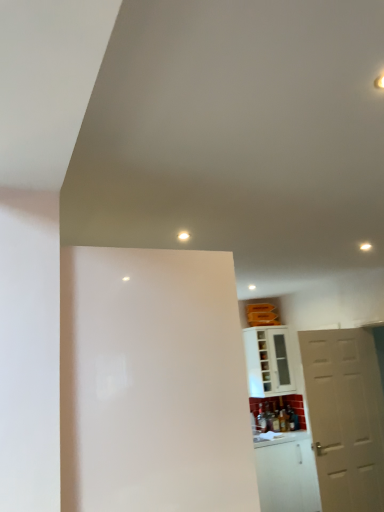
Question: Can you confirm if white matte door at right is wider than white glossy screen door at center?

Choices:
 (A) no
 (B) yes

Answer: (A)

Question: Can you confirm if white matte door at right is positioned to the right of white glossy screen door at center?

Choices:
 (A) yes
 (B) no

Answer: (A)

Question: Could you tell me if white matte door at right is facing white glossy screen door at center?

Choices:
 (A) yes
 (B) no

Answer: (B)

Question: Is white matte door at right in front of white glossy screen door at center?

Choices:
 (A) no
 (B) yes

Answer: (A)

Question: Considering the relative sizes of white matte door at right and white glossy screen door at center in the image provided, is white matte door at right smaller than white glossy screen door at center?

Choices:
 (A) no
 (B) yes

Answer: (B)

Question: Is white glossy cabinet at lower right inside or outside of white matte door at right?

Choices:
 (A) inside
 (B) outside

Answer: (B)

Question: Considering the positions of white glossy cabinet at lower right and white matte door at right in the image, is white glossy cabinet at lower right wider or thinner than white matte door at right?

Choices:
 (A) wide
 (B) thin

Answer: (A)

Question: From the image's perspective, is white glossy cabinet at lower right positioned above or below white matte door at right?

Choices:
 (A) above
 (B) below

Answer: (A)

Question: Considering the positions of white glossy cabinet at lower right and white matte door at right in the image, is white glossy cabinet at lower right bigger or smaller than white matte door at right?

Choices:
 (A) big
 (B) small

Answer: (B)

Question: Considering the positions of point (375, 437) and point (87, 449), is point (375, 437) closer or farther from the camera than point (87, 449)?

Choices:
 (A) farther
 (B) closer

Answer: (A)

Question: From a real-world perspective, is white matte door at right positioned above or below white glossy screen door at center?

Choices:
 (A) below
 (B) above

Answer: (A)

Question: Is white matte door at right to the left or to the right of white glossy screen door at center in the image?

Choices:
 (A) left
 (B) right

Answer: (B)

Question: Relative to white glossy screen door at center, is white matte door at right in front or behind?

Choices:
 (A) front
 (B) behind

Answer: (B)

Question: Is white glossy screen door at center wider or thinner than white matte door at right?

Choices:
 (A) wide
 (B) thin

Answer: (A)

Question: In terms of height, does white glossy screen door at center look taller or shorter compared to white matte door at right?

Choices:
 (A) short
 (B) tall

Answer: (A)